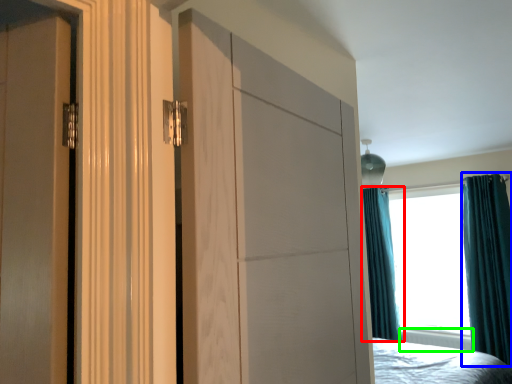
Question: Which object is positioned farthest from curtain (highlighted by a red box)? Select from curtain (highlighted by a blue box) and radiator (highlighted by a green box).

Choices:
 (A) curtain
 (B) radiator

Answer: (A)